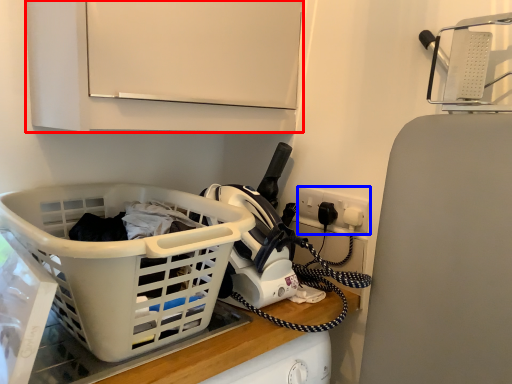
Question: Which of the following is the closest to the observer, cabinetry (highlighted by a red box) or electric outlet (highlighted by a blue box)?

Choices:
 (A) cabinetry
 (B) electric outlet

Answer: (A)